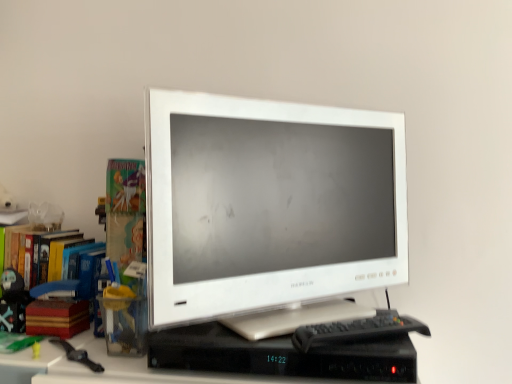
What are the coordinates of `wooden stack of books at left` in the screenshot? It's located at (57, 318).

Find the location of a particular element. Image resolution: width=512 pixels, height=384 pixels. wooden stack of books at left is located at coordinates (57, 318).

How distant is multicolored cardboard books at left from black plastic keyboard at center?

A distance of 25.56 inches exists between multicolored cardboard books at left and black plastic keyboard at center.

From the image's perspective, between multicolored cardboard books at left and black plastic keyboard at center, who is located below?

black plastic keyboard at center, from the image's perspective.

In the scene shown: Would you say multicolored cardboard books at left is inside or outside black plastic keyboard at center?

multicolored cardboard books at left cannot be found inside black plastic keyboard at center.

Considering the relative sizes of multicolored cardboard books at left and black plastic keyboard at center in the image provided, is multicolored cardboard books at left bigger than black plastic keyboard at center?

Correct, multicolored cardboard books at left is larger in size than black plastic keyboard at center.

At what (x,y) coordinates should I click in order to perform the action: click on paperback book on the right of the matte black figurine at left. Please return your answer as a coordinate pair (x, y). Looking at the image, I should click on (57, 318).

From the image's perspective, is matte black figurine at left over wooden stack of books at left?

Correct, matte black figurine at left appears higher than wooden stack of books at left in the image.

Looking at their sizes, would you say matte black figurine at left is wider or thinner than wooden stack of books at left?

Considering their sizes, matte black figurine at left looks slimmer than wooden stack of books at left.

Between matte black figurine at left and wooden stack of books at left, which one has less height?

With less height is wooden stack of books at left.

Which is more to the left, wooden stack of books at left or matte black figurine at left?

matte black figurine at left.

From the image's perspective, which is below, wooden stack of books at left or matte black figurine at left?

wooden stack of books at left appears lower in the image.

Does wooden stack of books at left have a lesser height compared to matte black figurine at left?

Correct, wooden stack of books at left is not as tall as matte black figurine at left.

Would you say wooden stack of books at left contains matte black figurine at left?

That's incorrect, matte black figurine at left is not inside wooden stack of books at left.

Do you think multicolored cardboard books at left is within black plastic computer desk at center, or outside of it?

The correct answer is: outside.

In terms of height, does multicolored cardboard books at left look taller or shorter compared to black plastic computer desk at center?

In the image, multicolored cardboard books at left appears to be taller than black plastic computer desk at center.

Which object is positioned more to the left, multicolored cardboard books at left or black plastic computer desk at center?

multicolored cardboard books at left.

From a real-world perspective, relative to wooden stack of books at left, is white glossy monitor at center vertically above or below?

Clearly, from a real-world perspective, white glossy monitor at center is above wooden stack of books at left.

From the image's perspective, would you say white glossy monitor at center is positioned over wooden stack of books at left?

Indeed, from the image's perspective, white glossy monitor at center is shown above wooden stack of books at left.

Is white glossy monitor at center not inside wooden stack of books at left?

Indeed, white glossy monitor at center is completely outside wooden stack of books at left.

Based on the photo, from a real-world perspective, is wooden stack of books at left positioned over black plastic keyboard at center based on gravity?

No, from a real-world perspective, wooden stack of books at left is not over black plastic keyboard at center

From their relative heights in the image, would you say wooden stack of books at left is taller or shorter than black plastic keyboard at center?

Considering their sizes, wooden stack of books at left has more height than black plastic keyboard at center.

Does wooden stack of books at left contain black plastic keyboard at center?

No, black plastic keyboard at center is not inside wooden stack of books at left.

Is wooden stack of books at left positioned with its back to black plastic keyboard at center?

wooden stack of books at left does not have its back to black plastic keyboard at center.

Considering the positions of objects black plastic computer desk at center and white glossy monitor at center in the image provided, who is more to the left, black plastic computer desk at center or white glossy monitor at center?

From the viewer's perspective, black plastic computer desk at center appears more on the left side.

From the image's perspective, which is below, black plastic computer desk at center or white glossy monitor at center?

black plastic computer desk at center, from the image's perspective.

Considering the relative sizes of black plastic computer desk at center and white glossy monitor at center in the image provided, is black plastic computer desk at center shorter than white glossy monitor at center?

Yes.

Is black plastic computer desk at center oriented towards white glossy monitor at center?

No, black plastic computer desk at center is not oriented towards white glossy monitor at center.

There is a black plastic keyboard at center. At what (x,y) coordinates should I click in order to perform the action: click on bookcase above it (from a real-world perspective). Please return your answer as a coordinate pair (x, y). The width and height of the screenshot is (512, 384). Looking at the image, I should click on (27, 254).

What are the coordinates of `toy that appears above the wooden stack of books at left (from the image's perspective)` in the screenshot? It's located at (13, 302).

Which object lies further to the anchor point matte black figurine at left, black plastic keyboard at center or multicolored cardboard books at left?

black plastic keyboard at center is further to matte black figurine at left.

When comparing their distances from black plastic computer desk at center, does multicolored cardboard books at left or white glossy monitor at center seem closer?

multicolored cardboard books at left lies closer to black plastic computer desk at center than the other object.

From the image, which object appears to be nearer to matte black figurine at left, white glossy monitor at center or black plastic keyboard at center?

Among the two, white glossy monitor at center is located nearer to matte black figurine at left.

Considering their positions, is multicolored cardboard books at left positioned further to black plastic keyboard at center than black plastic computer desk at center?

multicolored cardboard books at left is positioned further to the anchor black plastic keyboard at center.

Based on the photo, estimate the real-world distances between objects in this image. Which object is further from black plastic computer desk at center, matte black figurine at left or wooden stack of books at left?

Among the two, matte black figurine at left is located further to black plastic computer desk at center.

From the image, which object appears to be farther from matte black figurine at left, black plastic computer desk at center or multicolored cardboard books at left?

black plastic computer desk at center is positioned further to the anchor matte black figurine at left.

Which object lies nearer to the anchor point black plastic keyboard at center, black plastic computer desk at center or matte black figurine at left?

black plastic computer desk at center is positioned closer to the anchor black plastic keyboard at center.

In the scene shown: Considering their positions, is black plastic keyboard at center positioned closer to matte black figurine at left than wooden stack of books at left?

Among the two, wooden stack of books at left is located nearer to matte black figurine at left.

What are the coordinates of `computer desk situated between multicolored cardboard books at left and black plastic keyboard at center from left to right` in the screenshot? It's located at (120, 367).

Identify the location of toy between multicolored cardboard books at left and wooden stack of books at left in the horizontal direction. The image size is (512, 384). (13, 302).

Locate an element on the screen. The height and width of the screenshot is (384, 512). computer desk between multicolored cardboard books at left and white glossy monitor at center in the horizontal direction is located at coordinates (120, 367).

Image resolution: width=512 pixels, height=384 pixels. I want to click on computer desk between wooden stack of books at left and black plastic keyboard at center from left to right, so click(120, 367).